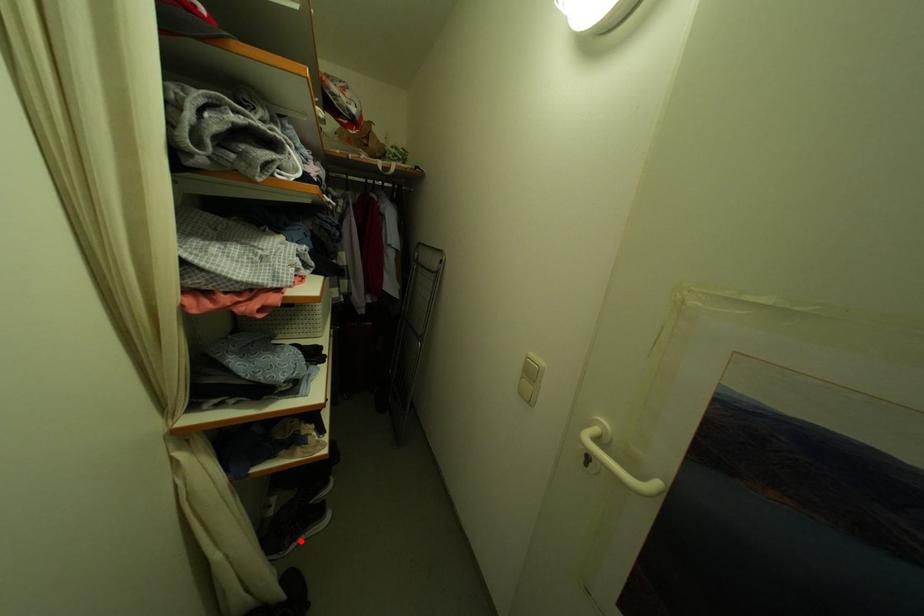
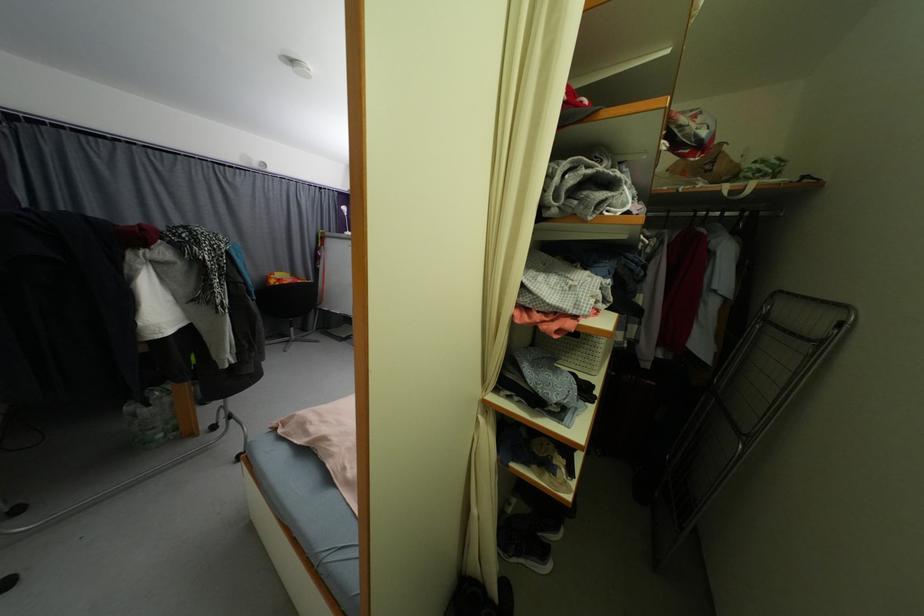
The point at the highlighted location is marked in the first image. Where is the corresponding point in the second image?

(524, 557)